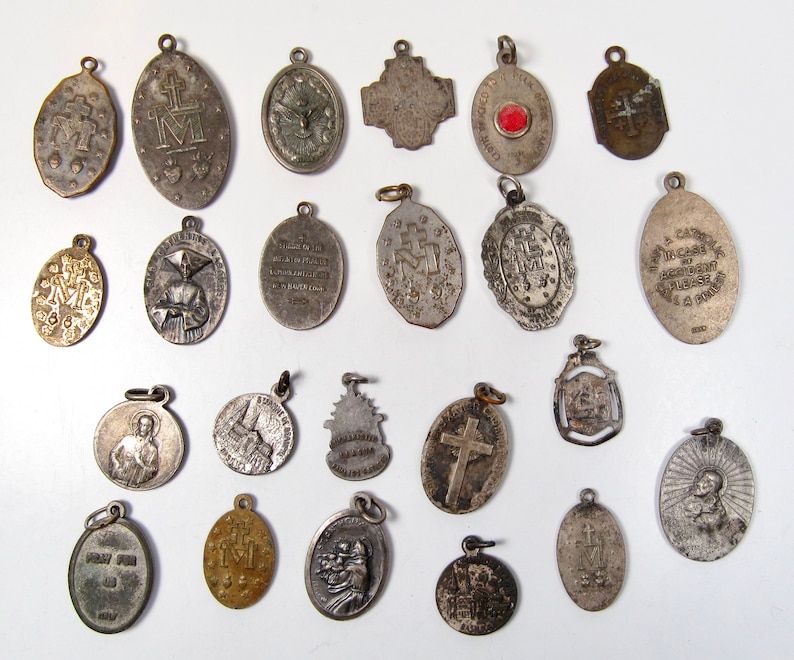
What are the coordinates of `cross / crucifix` in the screenshot? It's located at (75, 110), (171, 86), (625, 114), (409, 228), (464, 446), (525, 238), (584, 529), (241, 535), (72, 271).